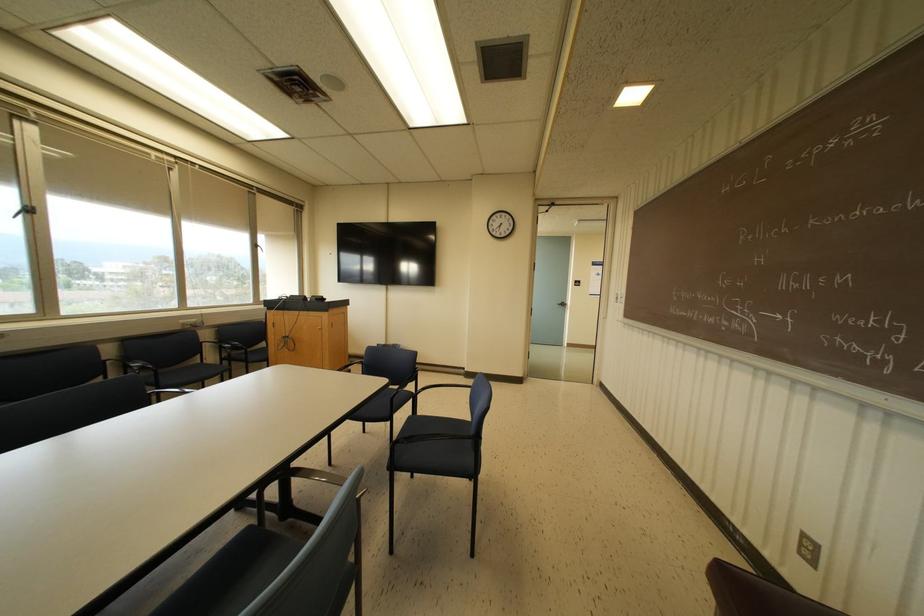
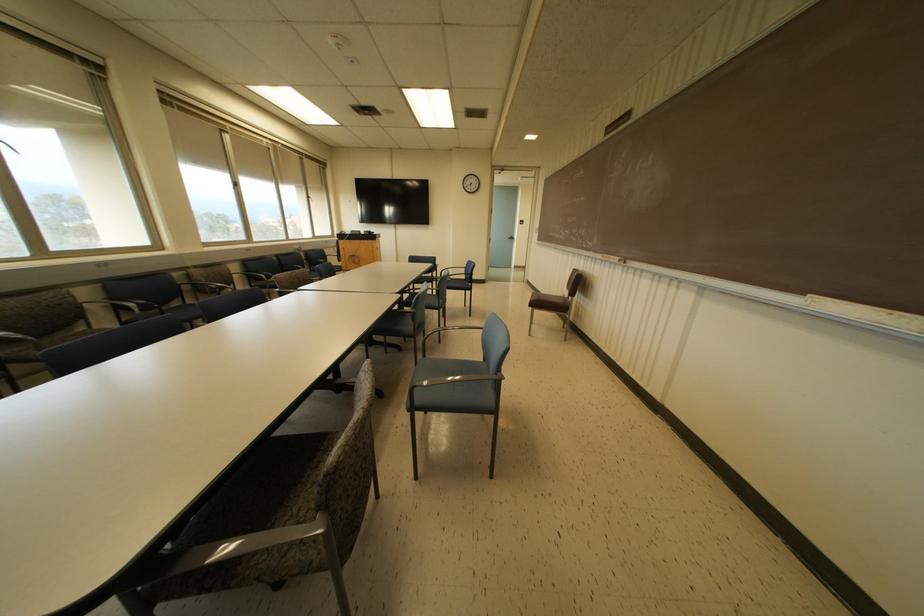
Question: What movement of the cameraman would produce the second image?

Choices:
 (A) Left
 (B) Right
 (C) Forward
 (D) Backward

Answer: (D)